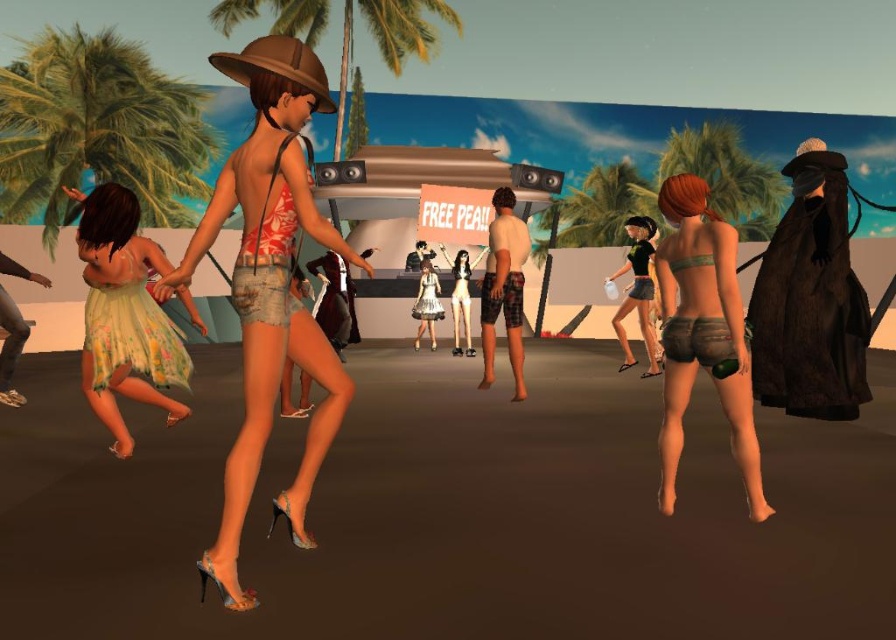
You are controlling a camera in this virtual environment. You want to capture a photo of the green leafy palm tree at left without any avatars blocking it. The camera is currently positioned at a certain point. Based on the distance between the camera and the palm tree, can you estimate whether the palm tree will be in focus if you set the camera to auto focus mode?

The green leafy palm tree at left and the camera are 46.62 feet apart. Since auto focus typically has a range that can handle this distance, the palm tree should be in focus when using auto focus mode.

You are an avatar in this virtual environment. You want to take a photo of the green leafy palm tree at left and the silver metallic dress at center. Which object should you position closer to the camera to ensure both are fully visible in the frame?

The green leafy palm tree at left has a lesser width compared to the silver metallic dress at center. To ensure both are fully visible in the frame, position the silver metallic dress at center closer to the camera since it is wider and requires more space in the photo.

You are navigating a virtual world and need to determine the proximity of two points in the scene. Given that you are facing the image, which of the two points, point (110, 230) or point (437, 1), is nearer to your viewpoint?

Point (110, 230) is closer to the camera than point (437, 1), so it is nearer to your viewpoint.